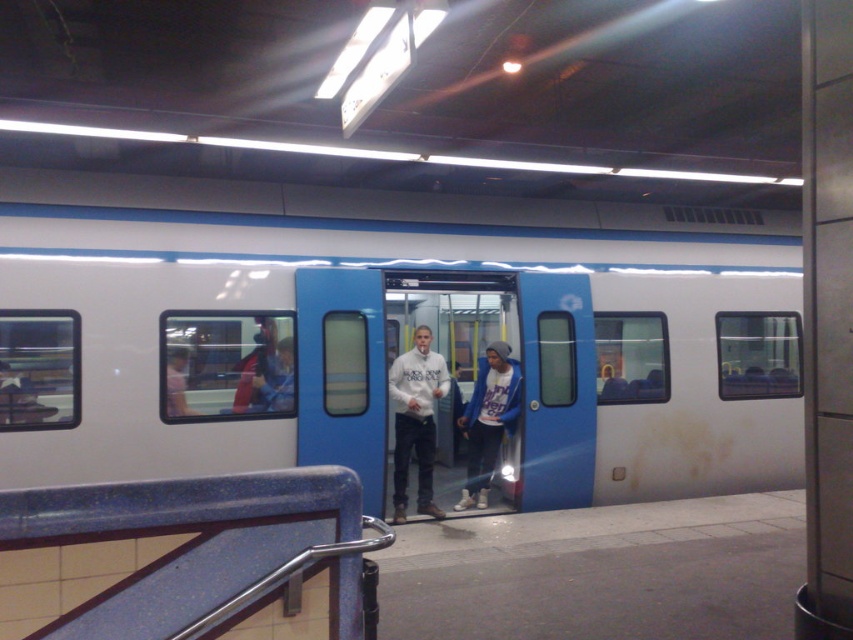
Does point (399, 445) come farther from viewer compared to point (511, 426)?

No, it is in front of (511, 426).

Is point (415, 404) positioned after point (511, 424)?

No, it is not.

This screenshot has height=640, width=853. What are the coordinates of `white matte hoodie at center` in the screenshot? It's located at (415, 420).

Does white matte train at center appear under white matte hoodie at center?

No.

Describe the element at coordinates (393, 346) in the screenshot. Image resolution: width=853 pixels, height=640 pixels. I see `white matte train at center` at that location.

This screenshot has height=640, width=853. In order to click on white matte train at center in this screenshot , I will do `click(393, 346)`.

Which is above, white matte train at center or white cotton hoodie at center?

white matte train at center is higher up.

The image size is (853, 640). What do you see at coordinates (393, 346) in the screenshot?
I see `white matte train at center` at bounding box center [393, 346].

This screenshot has width=853, height=640. Identify the location of white matte train at center. (393, 346).